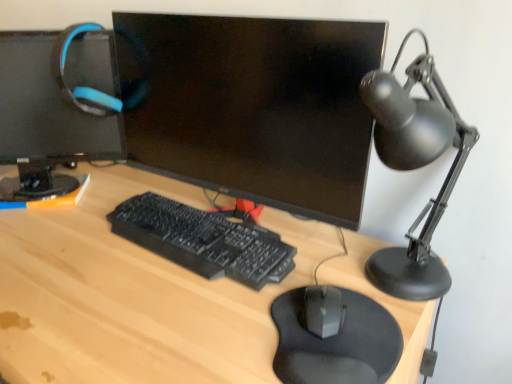
Locate an element on the screen. free location to the left of matte black monitor at center, acting as the 2th computer monitor starting from the left is located at coordinates (72, 243).